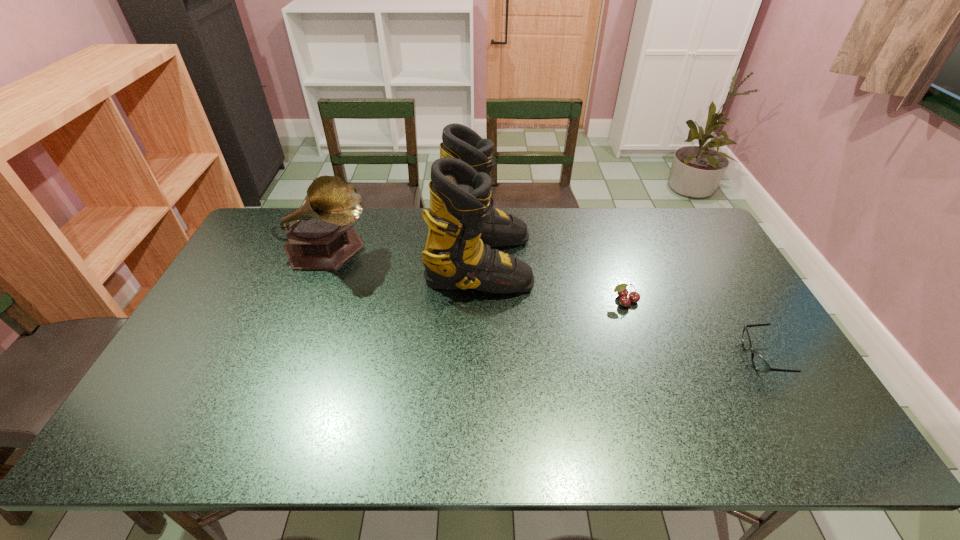
Identify the location of unoccupied area between the rightmost object and the third object from right to left. The image size is (960, 540). (620, 309).

The image size is (960, 540). Find the location of `free space that is in between the leftmost object and the tallest object`. free space that is in between the leftmost object and the tallest object is located at coordinates (403, 256).

Locate an element on the screen. The height and width of the screenshot is (540, 960). vacant area that lies between the rightmost object and the phonograph record is located at coordinates (544, 304).

This screenshot has height=540, width=960. Identify the location of empty location between the tallest object and the third shortest object. (403, 256).

Locate which object is the third closest to the nearest object. Please provide its 2D coordinates. Your answer should be formatted as a tuple, i.e. [(x, y)], where the tuple contains the x and y coordinates of a point satisfying the conditions above.

[(320, 234)]

Image resolution: width=960 pixels, height=540 pixels. Identify the location of object that is the third nearest to the leftmost object. click(759, 363).

The image size is (960, 540). Find the location of `free region that satisfies the following two spatial constraints: 1. on the horn direction of the ski boots; 2. on the left side of the phonograph record`. free region that satisfies the following two spatial constraints: 1. on the horn direction of the ski boots; 2. on the left side of the phonograph record is located at coordinates (324, 261).

At what (x,y) coordinates should I click in order to perform the action: click on free point that satisfies the following two spatial constraints: 1. on the horn direction of the ski boots; 2. on the right side of the leftmost object. Please return your answer as a coordinate pair (x, y). Image resolution: width=960 pixels, height=540 pixels. Looking at the image, I should click on (324, 261).